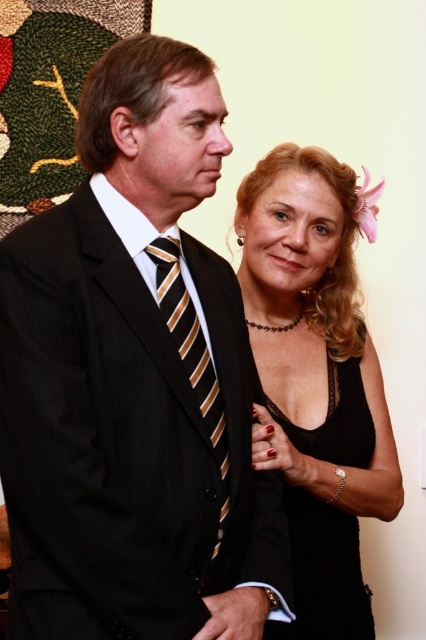
Question: In this image, where is matte black suit at center located relative to black lace tank top at center?

Choices:
 (A) left
 (B) right

Answer: (A)

Question: Which point appears closest to the camera in this image?

Choices:
 (A) (206, 426)
 (B) (319, 340)
 (C) (336, 388)

Answer: (A)

Question: Is matte black suit at center further to the viewer compared to black lace dress at right?

Choices:
 (A) yes
 (B) no

Answer: (B)

Question: Which point appears closest to the camera in this image?

Choices:
 (A) (299, 557)
 (B) (224, 428)

Answer: (B)

Question: Is matte black suit at center closer to the viewer compared to striped silk tie at center?

Choices:
 (A) no
 (B) yes

Answer: (B)

Question: Which object is farther from the camera taking this photo?

Choices:
 (A) striped silk tie at center
 (B) matte black suit at center

Answer: (A)